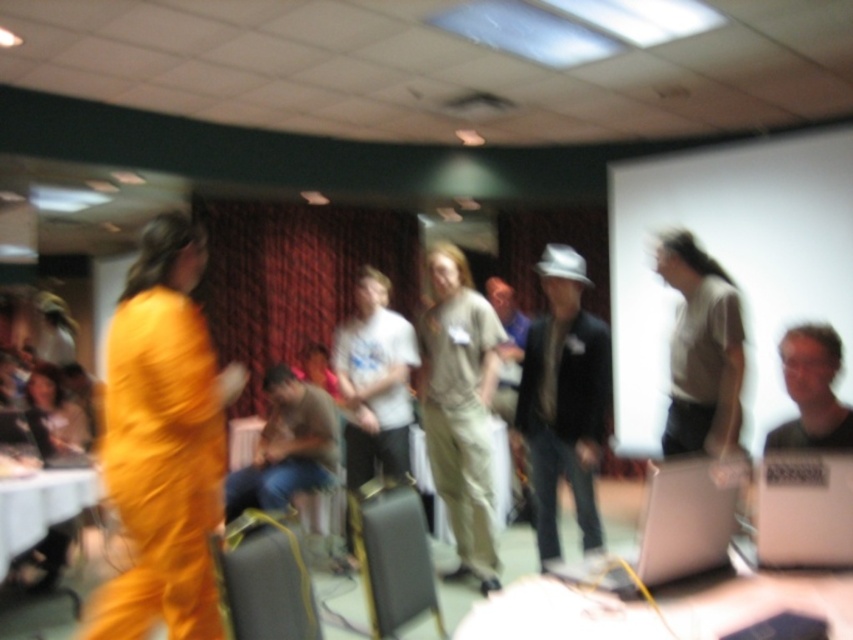
Does orange fabric jumpsuit at left appear on the left side of beige cotton shirt at center?

Indeed, orange fabric jumpsuit at left is positioned on the left side of beige cotton shirt at center.

Does point (109, 358) lie in front of point (471, 561)?

Yes.

At what (x,y) coordinates should I click in order to perform the action: click on orange fabric jumpsuit at left. Please return your answer as a coordinate pair (x, y). The height and width of the screenshot is (640, 853). Looking at the image, I should click on (161, 467).

Does orange fabric jumpsuit at left have a lesser height compared to silver metallic laptop at lower right?

In fact, orange fabric jumpsuit at left may be taller than silver metallic laptop at lower right.

Between orange fabric jumpsuit at left and silver metallic laptop at lower right, which one appears on the right side from the viewer's perspective?

Positioned to the right is silver metallic laptop at lower right.

Who is more distant from viewer, [146,458] or [787,465]?

The point [146,458] is behind.

Locate an element on the screen. orange fabric jumpsuit at left is located at coordinates (161, 467).

Does silver metallic laptop at lower right have a larger size compared to jeans at center?

No.

Who is shorter, silver metallic laptop at lower right or jeans at center?

silver metallic laptop at lower right is shorter.

Locate an element on the screen. silver metallic laptop at lower right is located at coordinates point(799,512).